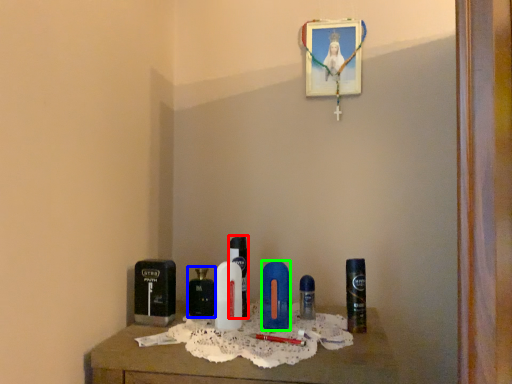
Question: Which is nearer to the perfume (highlighted by a red box)? perfume (highlighted by a blue box) or personal care (highlighted by a green box).

Choices:
 (A) perfume
 (B) personal care

Answer: (A)